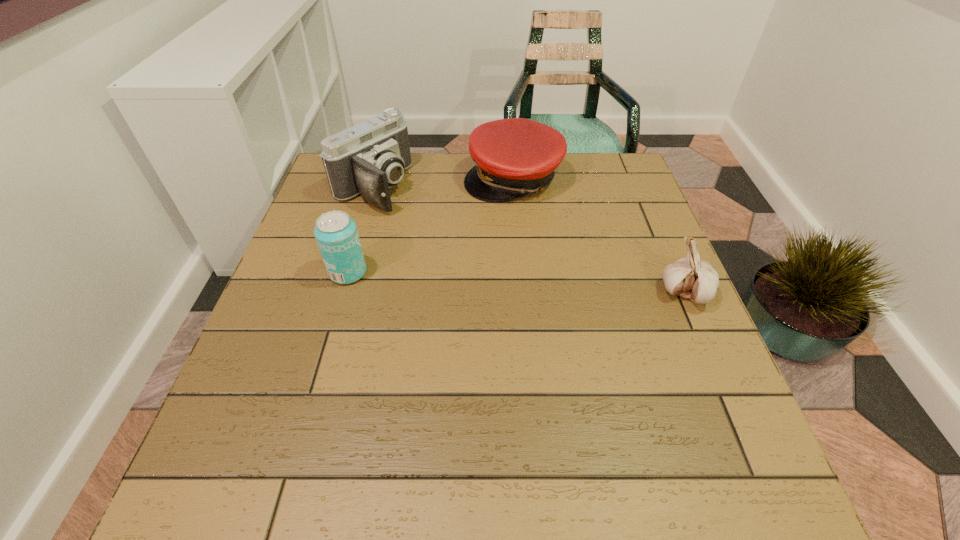
You are a GUI agent. You are given a task and a screenshot of the screen. Output one action in this format:
    pyautogui.click(x=<x>, y=<y>)
    Task: Click on the free location located at the front of the second object from right to left where the visor is located
    
    Given the screenshot: What is the action you would take?
    pyautogui.click(x=481, y=263)

The image size is (960, 540). What are the coordinates of `vacant space located 0.150m at the front of the second object from right to left where the visor is located` in the screenshot? It's located at (490, 241).

I want to click on camera present at the far edge, so click(369, 158).

This screenshot has height=540, width=960. I want to click on cap situated at the far edge, so click(x=513, y=157).

Locate an element on the screen. Image resolution: width=960 pixels, height=540 pixels. beer can present at the left edge is located at coordinates (336, 234).

At what (x,y) coordinates should I click in order to perform the action: click on camera positioned at the left edge. Please return your answer as a coordinate pair (x, y). The width and height of the screenshot is (960, 540). Looking at the image, I should click on (369, 158).

Identify the location of object positioned at the right edge. (692, 278).

The image size is (960, 540). Identify the location of object that is at the far left corner. (369, 158).

This screenshot has width=960, height=540. What are the coordinates of `vacant region at the far edge of the desktop` in the screenshot? It's located at (574, 159).

You are a GUI agent. You are given a task and a screenshot of the screen. Output one action in this format:
    pyautogui.click(x=<x>, y=<y>)
    Task: Click on the vacant area at the near edge of the desktop
    The height and width of the screenshot is (540, 960).
    Given the screenshot: What is the action you would take?
    462,399